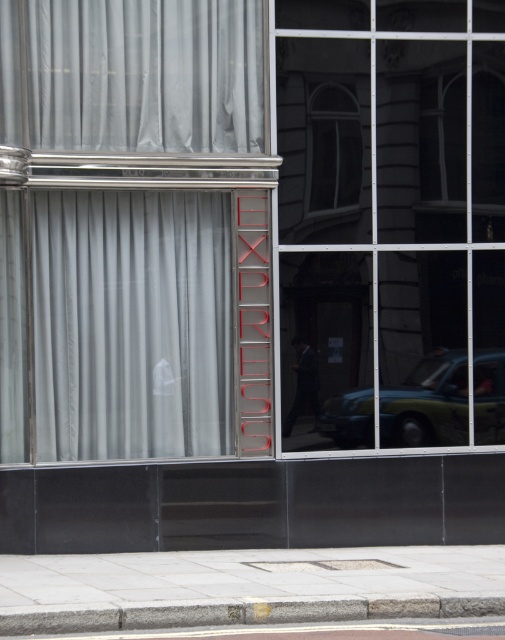
Question: Can you confirm if gray concrete curb at lower center is positioned to the right of transparent glass window at upper right?

Choices:
 (A) yes
 (B) no

Answer: (B)

Question: Which object appears farthest from the camera in this image?

Choices:
 (A) transparent glass window at upper right
 (B) dark gray suit at center
 (C) white sheer curtain at center
 (D) gray concrete curb at lower center

Answer: (A)

Question: Does white sheer curtain at center appear under transparent glass window at center?

Choices:
 (A) no
 (B) yes

Answer: (B)

Question: Based on their relative distances, which object is farther from the gray concrete curb at lower center?

Choices:
 (A) gray concrete pavement at lower center
 (B) dark gray suit at center

Answer: (B)

Question: Which point is closer to the camera?

Choices:
 (A) transparent glass window at upper right
 (B) transparent glass window at center
 (C) white sheer curtain at center

Answer: (C)

Question: Observing the image, what is the correct spatial positioning of clear glass window at center in reference to dark gray suit at center?

Choices:
 (A) right
 (B) left

Answer: (A)